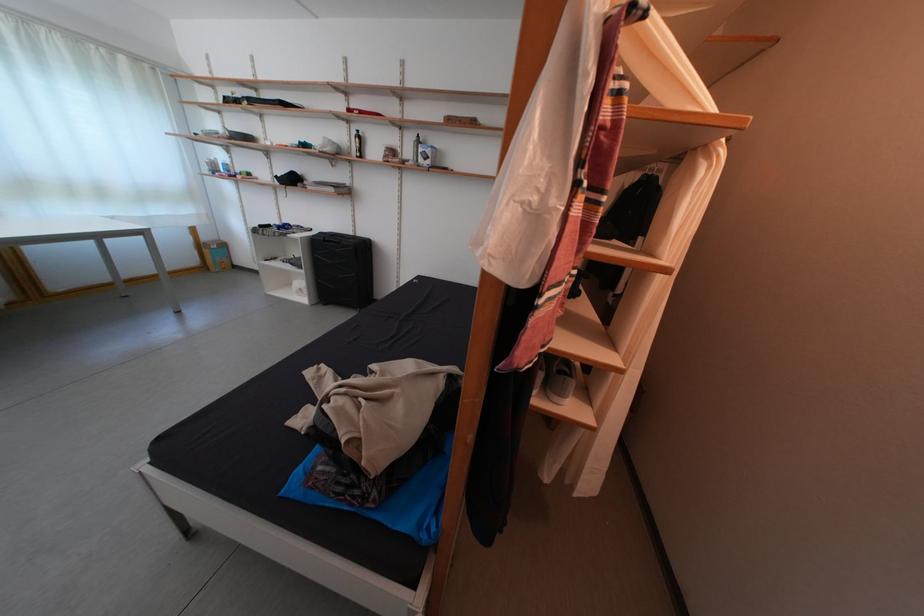
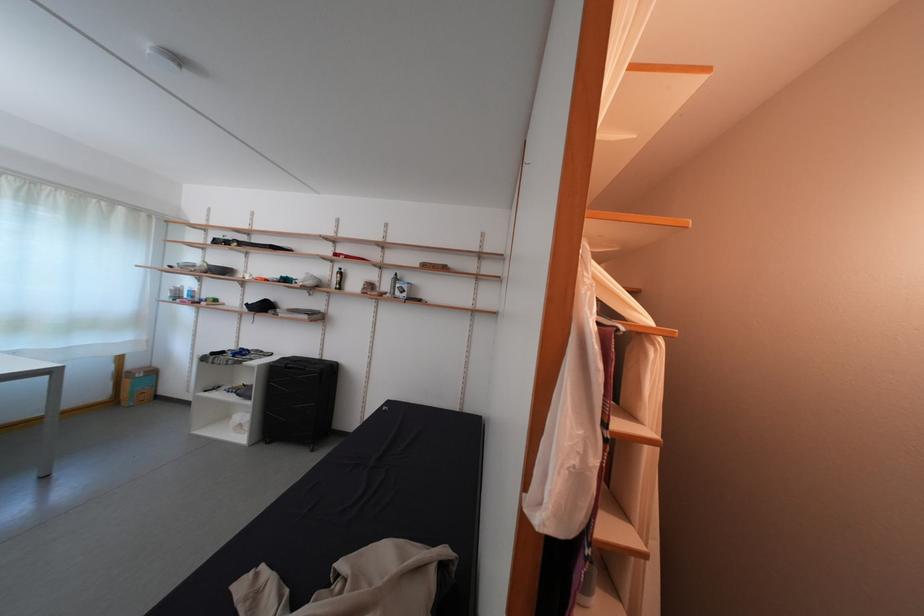
In the second image, find the point that corresponds to pixel 213 244 in the first image.

(140, 371)